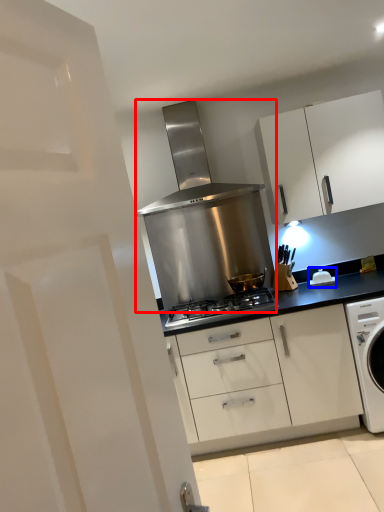
Question: Among these objects, which one is nearest to the camera, home appliance (highlighted by a red box) or appliance (highlighted by a blue box)?

Choices:
 (A) home appliance
 (B) appliance

Answer: (B)